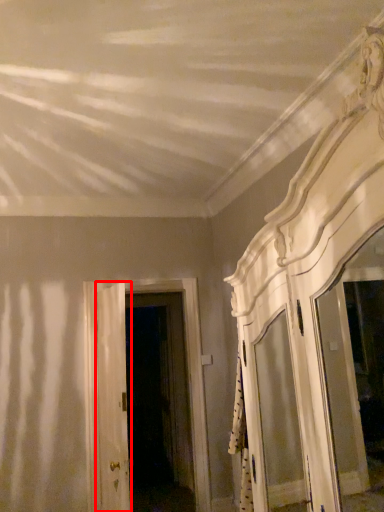
Question: Where is door (annotated by the red box) located in relation to door in the image?

Choices:
 (A) right
 (B) left

Answer: (B)